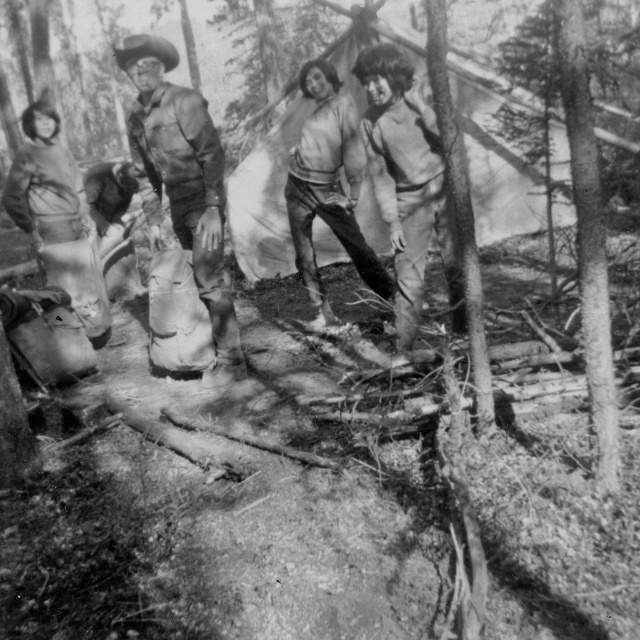
You are trying to locate the leather boots at center in the black and white photo. According to the coordinates given, where would you look first?

The leather boots at center are located at the 2D coordinates point (182, 182), so you should look first at that specific coordinate point in the image.

You are a photographer trying to capture a closeup of the leather boots at center and matte khaki pants at center in the scene. Which object should you zoom in on to ensure it fills the frame without cropping?

The leather boots at center is smaller than matte khaki pants at center, so you should zoom in on the leather boots at center to ensure it fills the frame without cropping.